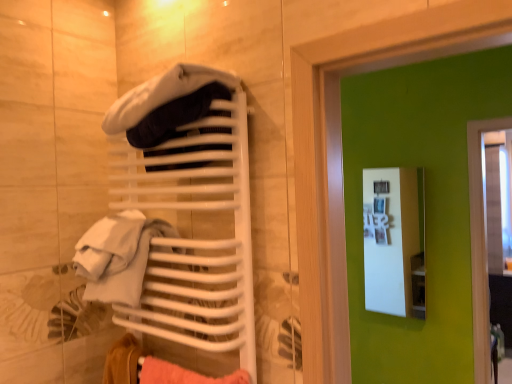
What is the approximate height of white glossy medicine cabinet at upper center?

The height of white glossy medicine cabinet at upper center is 3.28 feet.

The image size is (512, 384). Describe the element at coordinates (170, 108) in the screenshot. I see `velvety white hat at upper center` at that location.

What do you see at coordinates (196, 231) in the screenshot? This screenshot has height=384, width=512. I see `white matte towel rack at upper left` at bounding box center [196, 231].

Where is `white glossy medicine cabinet at upper center`? The height and width of the screenshot is (384, 512). white glossy medicine cabinet at upper center is located at coordinates (394, 241).

From a real-world perspective, which is physically below, white glossy medicine cabinet at upper center or velvety white hat at upper center?

white glossy medicine cabinet at upper center.

Is white glossy medicine cabinet at upper center inside the boundaries of velvety white hat at upper center, or outside?

white glossy medicine cabinet at upper center is outside velvety white hat at upper center.

Between white glossy medicine cabinet at upper center and velvety white hat at upper center, which one has larger size?

velvety white hat at upper center is bigger.

Considering the sizes of objects white glossy medicine cabinet at upper center and velvety white hat at upper center in the image provided, who is wider, white glossy medicine cabinet at upper center or velvety white hat at upper center?

velvety white hat at upper center is wider.

Is white matte towel rack at upper left taller or shorter than velvety white hat at upper center?

Clearly, white matte towel rack at upper left is taller compared to velvety white hat at upper center.

Is white matte towel rack at upper left looking in the opposite direction of velvety white hat at upper center?

Yes.

Is white matte towel rack at upper left to the right of velvety white hat at upper center from the viewer's perspective?

In fact, white matte towel rack at upper left is to the left of velvety white hat at upper center.

Does point (139, 309) come in front of point (156, 123)?

No, (139, 309) is further to viewer.

Looking at the image, does white matte towel rack at upper left seem bigger or smaller compared to white glossy medicine cabinet at upper center?

In the image, white matte towel rack at upper left appears to be larger than white glossy medicine cabinet at upper center.

Which object is wider, white matte towel rack at upper left or white glossy medicine cabinet at upper center?

With larger width is white matte towel rack at upper left.

Is white matte towel rack at upper left beside white glossy medicine cabinet at upper center?

white matte towel rack at upper left and white glossy medicine cabinet at upper center are not in contact.

From a real-world perspective, which object rests below the other?

white glossy medicine cabinet at upper center is physically lower.

From a real-world perspective, is velvety white hat at upper center above or below white matte towel rack at upper left?

velvety white hat at upper center is situated higher than white matte towel rack at upper left in the real world.

Could white matte towel rack at upper left be considered to be inside velvety white hat at upper center?

That's incorrect, white matte towel rack at upper left is not inside velvety white hat at upper center.

Find the location of `clothing to the right of white matte towel rack at upper left`. clothing to the right of white matte towel rack at upper left is located at coordinates (170, 108).

Is white glossy medicine cabinet at upper center behind white matte towel rack at upper left?

Yes, white glossy medicine cabinet at upper center is further from the camera.

From the image's perspective, is white glossy medicine cabinet at upper center under white matte towel rack at upper left?

Indeed, from the image's perspective, white glossy medicine cabinet at upper center is shown beneath white matte towel rack at upper left.

Is white glossy medicine cabinet at upper center bigger or smaller than white matte towel rack at upper left?

Clearly, white glossy medicine cabinet at upper center is smaller in size than white matte towel rack at upper left.

Which of these two, white glossy medicine cabinet at upper center or white matte towel rack at upper left, is thinner?

With smaller width is white glossy medicine cabinet at upper center.

Is white glossy medicine cabinet at upper center inside velvety white hat at upper center?

That's incorrect, white glossy medicine cabinet at upper center is not inside velvety white hat at upper center.

Can you confirm if velvety white hat at upper center is bigger than white glossy medicine cabinet at upper center?

Yes.

Which of these two, velvety white hat at upper center or white glossy medicine cabinet at upper center, is thinner?

Thinner between the two is white glossy medicine cabinet at upper center.

What's the angular difference between velvety white hat at upper center and white glossy medicine cabinet at upper center's facing directions?

velvety white hat at upper center and white glossy medicine cabinet at upper center are facing 0.000699 degrees away from each other.

The height and width of the screenshot is (384, 512). In order to click on clothing in front of the white glossy medicine cabinet at upper center in this screenshot , I will do `click(170, 108)`.

The height and width of the screenshot is (384, 512). What are the coordinates of `closet below the velvety white hat at upper center (from the image's perspective)` in the screenshot? It's located at (196, 231).

From the image, which object appears to be farther from white glossy medicine cabinet at upper center, velvety white hat at upper center or white matte towel rack at upper left?

velvety white hat at upper center lies further to white glossy medicine cabinet at upper center than the other object.

Looking at the image, which one is located closer to velvety white hat at upper center, white glossy medicine cabinet at upper center or white matte towel rack at upper left?

Based on the image, white matte towel rack at upper left appears to be nearer to velvety white hat at upper center.

Estimate the real-world distances between objects in this image. Which object is further from velvety white hat at upper center, white matte towel rack at upper left or white glossy medicine cabinet at upper center?

white glossy medicine cabinet at upper center lies further to velvety white hat at upper center than the other object.

From the image, which object appears to be farther from white matte towel rack at upper left, velvety white hat at upper center or white glossy medicine cabinet at upper center?

white glossy medicine cabinet at upper center.

Based on their spatial positions, is white glossy medicine cabinet at upper center or velvety white hat at upper center closer to white matte towel rack at upper left?

velvety white hat at upper center is closer to white matte towel rack at upper left.

Based on the photo, when comparing their distances from white glossy medicine cabinet at upper center, does white matte towel rack at upper left or velvety white hat at upper center seem closer?

Among the two, white matte towel rack at upper left is located nearer to white glossy medicine cabinet at upper center.

Find the location of `closet between velvety white hat at upper center and white glossy medicine cabinet at upper center along the z-axis`. closet between velvety white hat at upper center and white glossy medicine cabinet at upper center along the z-axis is located at coordinates (196, 231).